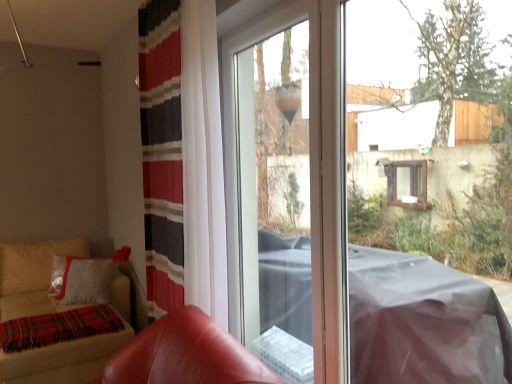
Locate an element on the screen. transparent plastic screen door at center is located at coordinates pyautogui.click(x=266, y=168).

What is the approximate height of velvet beige sofa at lower left?

35.04 inches.

The image size is (512, 384). What do you see at coordinates (186, 354) in the screenshot?
I see `leather armchair at lower left` at bounding box center [186, 354].

At what (x,y) coordinates should I click in order to perform the action: click on transparent plastic screen door at center. Please return your answer as a coordinate pair (x, y). This screenshot has height=384, width=512. Looking at the image, I should click on 266,168.

From the image's perspective, is leather armchair at lower left under velvet beige sofa at lower left?

No.

Considering the relative positions of leather armchair at lower left and velvet beige sofa at lower left in the image provided, is leather armchair at lower left to the left of velvet beige sofa at lower left from the viewer's perspective?

Incorrect, leather armchair at lower left is not on the left side of velvet beige sofa at lower left.

How far apart are leather armchair at lower left and velvet beige sofa at lower left?

leather armchair at lower left and velvet beige sofa at lower left are 6.99 feet apart from each other.

Is velvet beige sofa at lower left a part of leather armchair at lower left?

No, velvet beige sofa at lower left is not a part of leather armchair at lower left.

From the image's perspective, which one is positioned higher, velvet beige sofa at lower left or leather armchair at lower left?

From the image's view, leather armchair at lower left is above.

Who is more distant, velvet beige sofa at lower left or leather armchair at lower left?

velvet beige sofa at lower left is further away from the camera.

Is transparent plastic screen door at center at the left side of velvet beige sofa at lower left?

No, transparent plastic screen door at center is not to the left of velvet beige sofa at lower left.

Can velvet beige sofa at lower left be found inside transparent plastic screen door at center?

No, velvet beige sofa at lower left is not a part of transparent plastic screen door at center.

From a real-world perspective, is transparent plastic screen door at center under velvet beige sofa at lower left?

Incorrect, from a real-world perspective, transparent plastic screen door at center is higher than velvet beige sofa at lower left.

Does transparent plastic screen door at center have a smaller size compared to velvet beige sofa at lower left?

Yes.

I want to click on screen door above the plaid woolen blanket at lower left (from the image's perspective), so click(x=266, y=168).

Between transparent plastic screen door at center and plaid woolen blanket at lower left, which one is positioned in front?

transparent plastic screen door at center is in front.

Does transparent plastic screen door at center appear on the right side of plaid woolen blanket at lower left?

Yes, transparent plastic screen door at center is to the right of plaid woolen blanket at lower left.

Is point (232, 290) farther from viewer compared to point (98, 330)?

No, (232, 290) is in front of (98, 330).

Consider the image. Between plaid woolen blanket at lower left and transparent plastic screen door at center, which one has smaller width?

transparent plastic screen door at center.

Is transparent plastic screen door at center completely or partially inside plaid woolen blanket at lower left?

No, transparent plastic screen door at center is not a part of plaid woolen blanket at lower left.

Which is behind, plaid woolen blanket at lower left or transparent plastic screen door at center?

plaid woolen blanket at lower left is more distant.

Is plaid woolen blanket at lower left oriented away from transparent plastic screen door at center?

No, plaid woolen blanket at lower left is not facing away from transparent plastic screen door at center.

I want to click on armchair in front of the transparent plastic screen door at center, so click(x=186, y=354).

From the picture: How many degrees apart are the facing directions of transparent plastic screen door at center and leather armchair at lower left?

transparent plastic screen door at center and leather armchair at lower left are facing 6.19 degrees away from each other.

Is transparent plastic screen door at center turned away from leather armchair at lower left?

transparent plastic screen door at center does not have its back to leather armchair at lower left.

From a real-world perspective, which is physically above, transparent plastic screen door at center or leather armchair at lower left?

transparent plastic screen door at center.

Does velvet beige sofa at lower left appear on the left side of transparent plastic screen door at center?

Yes, velvet beige sofa at lower left is to the left of transparent plastic screen door at center.

Is velvet beige sofa at lower left oriented away from transparent plastic screen door at center?

No.

Is velvet beige sofa at lower left positioned beyond the bounds of transparent plastic screen door at center?

velvet beige sofa at lower left is positioned outside transparent plastic screen door at center.

Is velvet beige sofa at lower left taller than transparent plastic screen door at center?

In fact, velvet beige sofa at lower left may be shorter than transparent plastic screen door at center.

Where is `furniture that appears below the leather armchair at lower left (from the image's perspective)`? The image size is (512, 384). furniture that appears below the leather armchair at lower left (from the image's perspective) is located at coordinates (72, 350).

Identify the location of armchair on the right of velvet beige sofa at lower left. (186, 354).

From the image, which object appears to be farther from plaid woolen blanket at lower left, leather armchair at lower left or velvet beige sofa at lower left?

Based on the image, leather armchair at lower left appears to be further to plaid woolen blanket at lower left.

Based on the photo, estimate the real-world distances between objects in this image. Which object is closer to transparent plastic screen door at center, plaid woolen blanket at lower left or velvet beige sofa at lower left?

plaid woolen blanket at lower left is positioned closer to the anchor transparent plastic screen door at center.

When comparing their distances from leather armchair at lower left, does plaid woolen blanket at lower left or velvet beige sofa at lower left seem closer?

The object closer to leather armchair at lower left is plaid woolen blanket at lower left.

Looking at this image, from the image, which object appears to be nearer to leather armchair at lower left, plaid woolen blanket at lower left or transparent plastic screen door at center?

transparent plastic screen door at center lies closer to leather armchair at lower left than the other object.

When comparing their distances from transparent plastic screen door at center, does velvet beige sofa at lower left or plaid woolen blanket at lower left seem closer?

plaid woolen blanket at lower left.

Based on their spatial positions, is plaid woolen blanket at lower left or leather armchair at lower left further from transparent plastic screen door at center?

plaid woolen blanket at lower left lies further to transparent plastic screen door at center than the other object.

Looking at this image, estimate the real-world distances between objects in this image. Which object is further from plaid woolen blanket at lower left, velvet beige sofa at lower left or transparent plastic screen door at center?

transparent plastic screen door at center is further to plaid woolen blanket at lower left.

From the image, which object appears to be nearer to transparent plastic screen door at center, leather armchair at lower left or velvet beige sofa at lower left?

leather armchair at lower left is positioned closer to the anchor transparent plastic screen door at center.

Image resolution: width=512 pixels, height=384 pixels. I want to click on armchair between velvet beige sofa at lower left and transparent plastic screen door at center, so click(186, 354).

I want to click on furniture between leather armchair at lower left and plaid woolen blanket at lower left along the z-axis, so click(x=72, y=350).

Where is `blanket between velvet beige sofa at lower left and transparent plastic screen door at center in the horizontal direction`? Image resolution: width=512 pixels, height=384 pixels. blanket between velvet beige sofa at lower left and transparent plastic screen door at center in the horizontal direction is located at coordinates (58, 327).

Locate an element on the screen. screen door located between leather armchair at lower left and plaid woolen blanket at lower left in the depth direction is located at coordinates (266, 168).